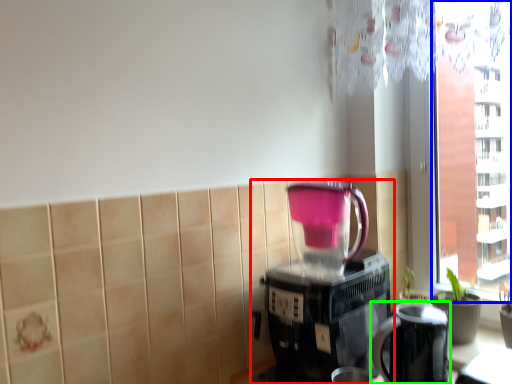
Question: Which object is positioned farthest from coffee maker (highlighted by a red box)? Select from window screen (highlighted by a blue box) and appliance (highlighted by a green box).

Choices:
 (A) window screen
 (B) appliance

Answer: (A)